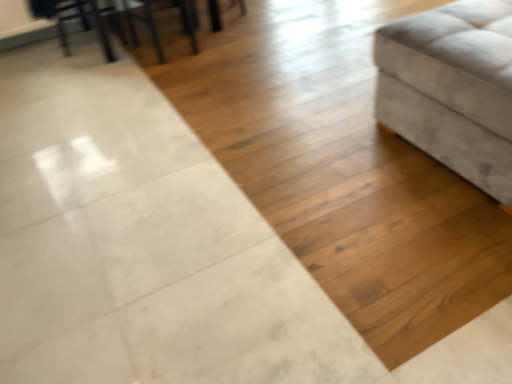
Question: From a real-world perspective, is metallic silver swivel chair at upper left physically located above or below metallic black chair at upper left?

Choices:
 (A) above
 (B) below

Answer: (B)

Question: In terms of size, does metallic silver swivel chair at upper left appear bigger or smaller than metallic black chair at upper left?

Choices:
 (A) big
 (B) small

Answer: (A)

Question: Estimate the real-world distances between objects in this image. Which object is farther from the metallic black chair at upper left?

Choices:
 (A) metallic silver swivel chair at upper left
 (B) wooden table at upper left
 (C) suede-like beige ottoman at right

Answer: (C)

Question: Estimate the real-world distances between objects in this image. Which object is farther from the metallic black chair at upper left?

Choices:
 (A) wooden table at upper left
 (B) metallic silver swivel chair at upper left
 (C) suede-like beige ottoman at right

Answer: (C)